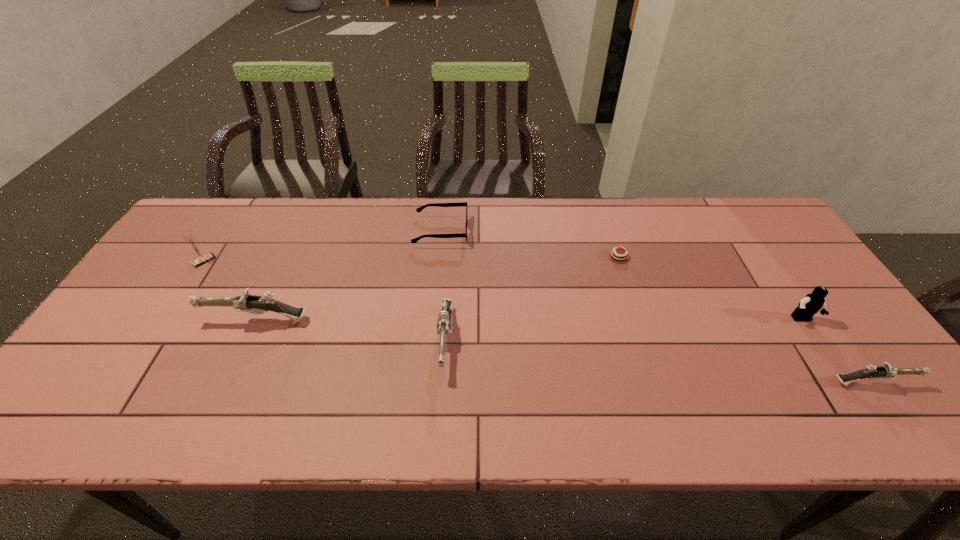
What are the coordinates of `object that is at the left edge` in the screenshot? It's located at (201, 258).

Image resolution: width=960 pixels, height=540 pixels. What are the coordinates of `gun that is positioned at the right edge` in the screenshot? It's located at (886, 371).

Identify the location of Lego located at the right edge. This screenshot has height=540, width=960. [x=811, y=303].

Locate an element on the screen. This screenshot has width=960, height=540. object that is at the near right corner is located at coordinates (886, 371).

At what (x,y) coordinates should I click in order to perform the action: click on vacant area at the far edge. Please return your answer as a coordinate pair (x, y). Image resolution: width=960 pixels, height=540 pixels. Looking at the image, I should click on (569, 206).

Identify the location of free location at the near edge. The image size is (960, 540). (563, 368).

Identify the location of vacant space at the left edge. (153, 315).

I want to click on free space at the right edge of the desktop, so pos(806,324).

The height and width of the screenshot is (540, 960). In the image, there is a desktop. Identify the location of vacant space at the far left corner. (237, 206).

Find the location of `vacant space at the far right corner of the desktop`. vacant space at the far right corner of the desktop is located at coordinates (774, 238).